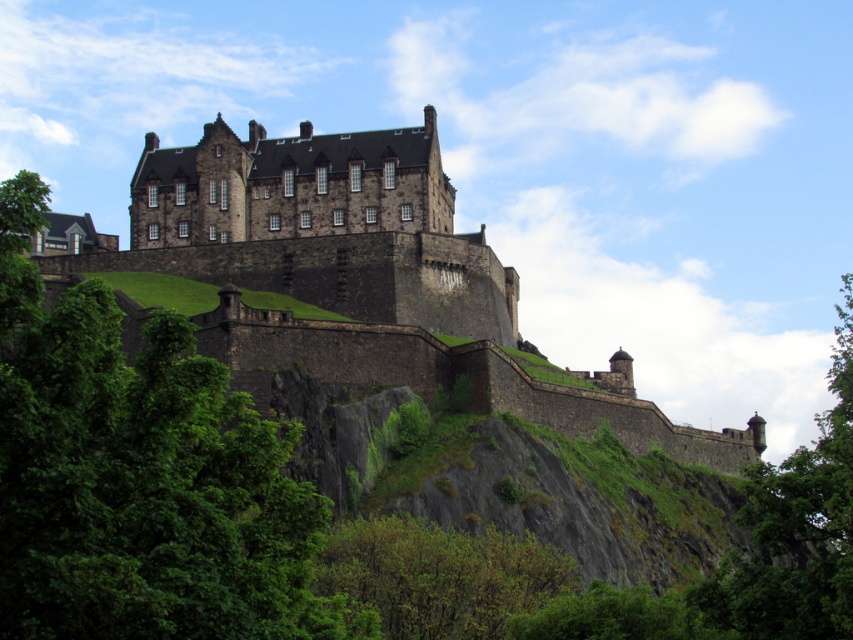
How much distance is there between green leafy tree at upper center and green leafy tree at right?

green leafy tree at upper center is 33.12 meters from green leafy tree at right.

Is green leafy tree at upper center to the left of green leafy tree at right from the viewer's perspective?

Indeed, green leafy tree at upper center is positioned on the left side of green leafy tree at right.

Locate an element on the screen. The width and height of the screenshot is (853, 640). green leafy tree at upper center is located at coordinates (137, 476).

Is green leafy tree at upper center positioned in front of dark stone castle at center?

Yes, it is in front of dark stone castle at center.

How much distance is there between green leafy tree at upper center and dark stone castle at center?

A distance of 155.30 feet exists between green leafy tree at upper center and dark stone castle at center.

Between point (225, 451) and point (276, 253), which one is positioned behind?

Point (276, 253)

The height and width of the screenshot is (640, 853). I want to click on green leafy tree at upper center, so click(x=137, y=476).

Is point (3, 189) in front of point (482, 280)?

Yes, it is.

Which is above, green leafy tree at upper center or dark stone castle at upper center?

dark stone castle at upper center

This screenshot has height=640, width=853. I want to click on green leafy tree at upper center, so click(x=137, y=476).